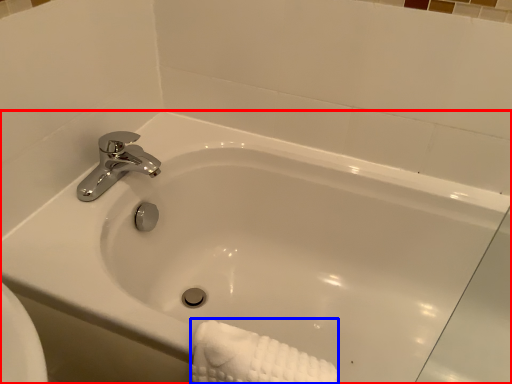
Question: Which of the following is the closest to the observer, bathtub (highlighted by a red box) or bath towel (highlighted by a blue box)?

Choices:
 (A) bathtub
 (B) bath towel

Answer: (A)